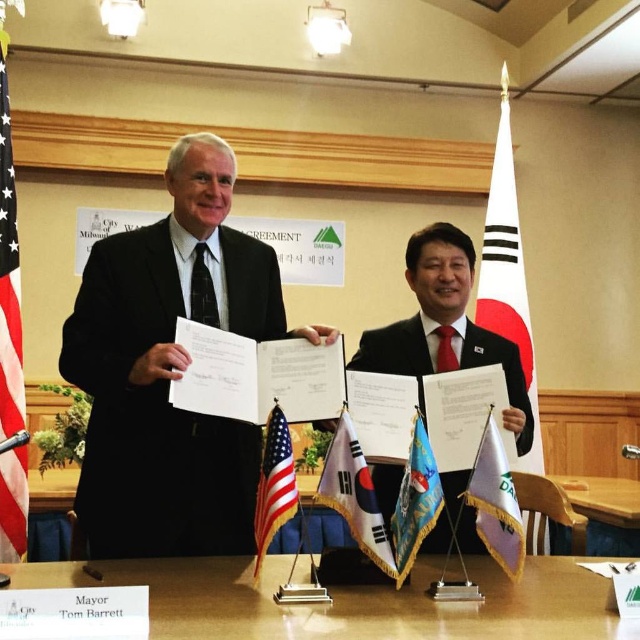
Between point (528, 392) and point (364, 541), which one is positioned in front?

Positioned in front is point (364, 541).

Which is below, white fabric flag at right or white fabric flag at center?

Positioned lower is white fabric flag at center.

Measure the distance between point (x=532, y=400) and camera.

Point (x=532, y=400) and camera are 3.35 meters apart.

What are the coordinates of `white fabric flag at right` in the screenshot? It's located at (508, 273).

Can you confirm if brown wooden table at center is positioned to the left of blue fabric flag at center?

Correct, you'll find brown wooden table at center to the left of blue fabric flag at center.

Between brown wooden table at center and blue fabric flag at center, which one appears on the left side from the viewer's perspective?

brown wooden table at center is more to the left.

Is point (193, 612) positioned in front of point (408, 525)?

Yes, point (193, 612) is closer to viewer.

You are a GUI agent. You are given a task and a screenshot of the screen. Output one action in this format:
    pyautogui.click(x=<x>, y=<y>)
    Task: Click on the brown wooden table at center
    The image size is (640, 640).
    Given the screenshot: What is the action you would take?
    pyautogui.click(x=352, y=602)

Measure the distance between black suit at center and camera.

They are 5.91 feet apart.

Where is `black suit at center`? black suit at center is located at coordinates (170, 371).

Identify the location of black suit at center. (170, 371).